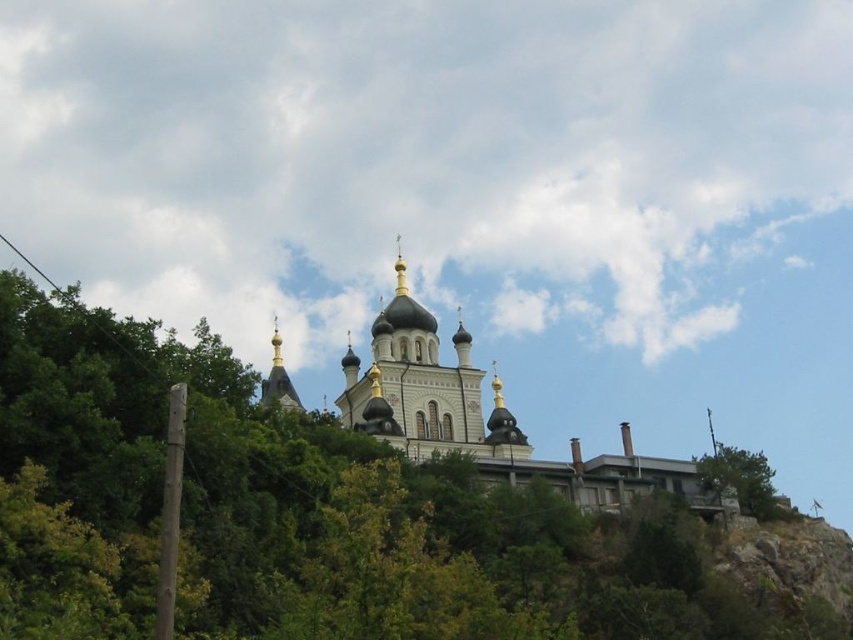
You are standing at the base of the hill looking up at the church. There are two points marked in the image. Which point is closer to you, point (x=467, y=417) or point (x=743, y=467)?

Point (x=467, y=417) is closer to you because it is further to the viewer than point (x=743, y=467).

You are standing at the base of the hill where the wooden utility pole with wires is located. Looking up towards the church, which direction should you face to see the white stone church at upper center?

The white stone church at upper center is located at point (482, 419), which means it is positioned towards the upper right side of your view. Therefore, you should look towards the upper right direction to see it.